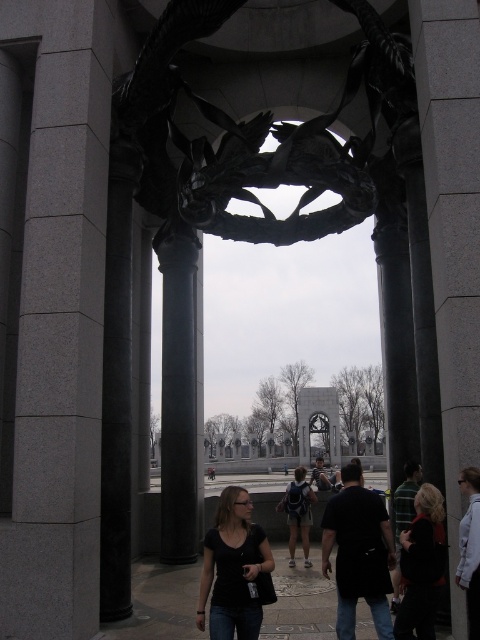
Question: Where is black fabric jacket at lower right located in relation to white shirt at center in the image?

Choices:
 (A) right
 (B) left

Answer: (B)

Question: Which object appears closest to the camera in this image?

Choices:
 (A) gray stone pillar at center
 (B) black fabric jacket at lower right
 (C) gray granite column at left

Answer: (A)

Question: Based on their relative distances, which object is nearer to the white shirt at center?

Choices:
 (A) black polished stone column at left
 (B) gray stone pillar at center

Answer: (B)

Question: Which of the following is the farthest from the observer?

Choices:
 (A) pos(443,292)
 (B) pos(64,308)
 (C) pos(411,616)
 (D) pos(253,637)

Answer: (B)

Question: Can you confirm if polished bronze dragon at center is wider than white shirt at center?

Choices:
 (A) no
 (B) yes

Answer: (B)

Question: Can you confirm if polished bronze dragon at center is thinner than black matte shirt at center?

Choices:
 (A) yes
 (B) no

Answer: (B)